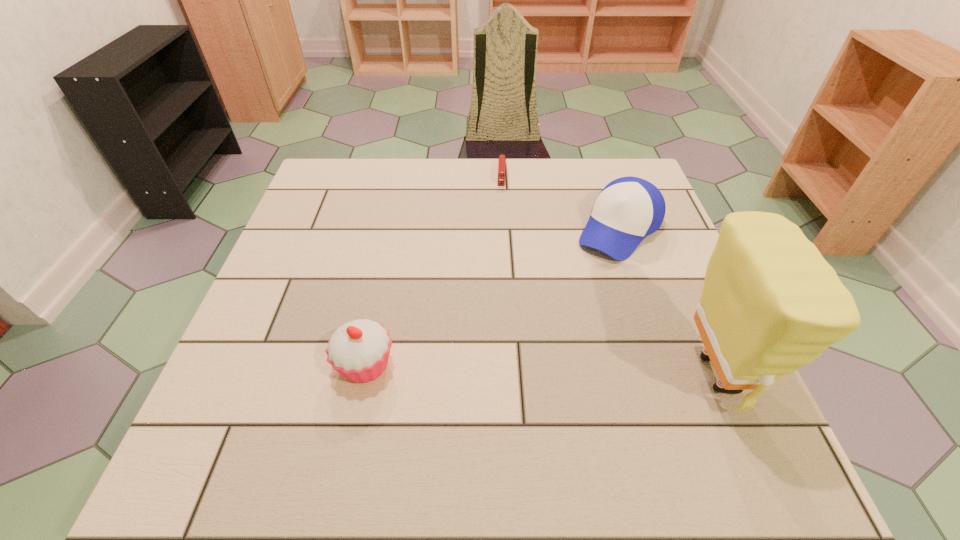
Locate an element on the screen. The image size is (960, 540). blank space located on the front-facing side of the farthest object is located at coordinates (499, 248).

Locate an element on the screen. Image resolution: width=960 pixels, height=540 pixels. vacant space positioned 0.260m on the front-facing side of the farthest object is located at coordinates (499, 248).

Identify the location of baseball cap that is at the far edge. Image resolution: width=960 pixels, height=540 pixels. (628, 209).

You are a GUI agent. You are given a task and a screenshot of the screen. Output one action in this format:
    pyautogui.click(x=<x>, y=<y>)
    Task: Click on the stapler that is at the far edge
    This screenshot has width=960, height=540.
    Given the screenshot: What is the action you would take?
    pyautogui.click(x=502, y=159)

This screenshot has width=960, height=540. I want to click on cupcake present at the near edge, so click(359, 350).

Identify the location of sponge present at the near edge. The width and height of the screenshot is (960, 540). (771, 304).

Where is `sponge that is at the right edge`? The width and height of the screenshot is (960, 540). sponge that is at the right edge is located at coordinates (771, 304).

Identify the location of baseball cap that is at the right edge. The height and width of the screenshot is (540, 960). (628, 209).

Identify the location of object that is at the far right corner. This screenshot has width=960, height=540. (628, 209).

Identify the location of object at the near right corner. (771, 304).